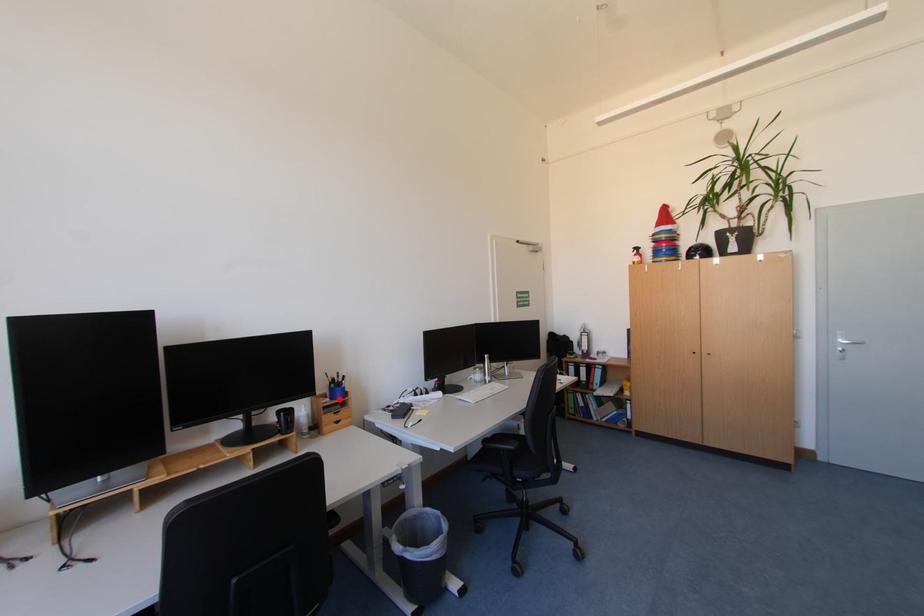
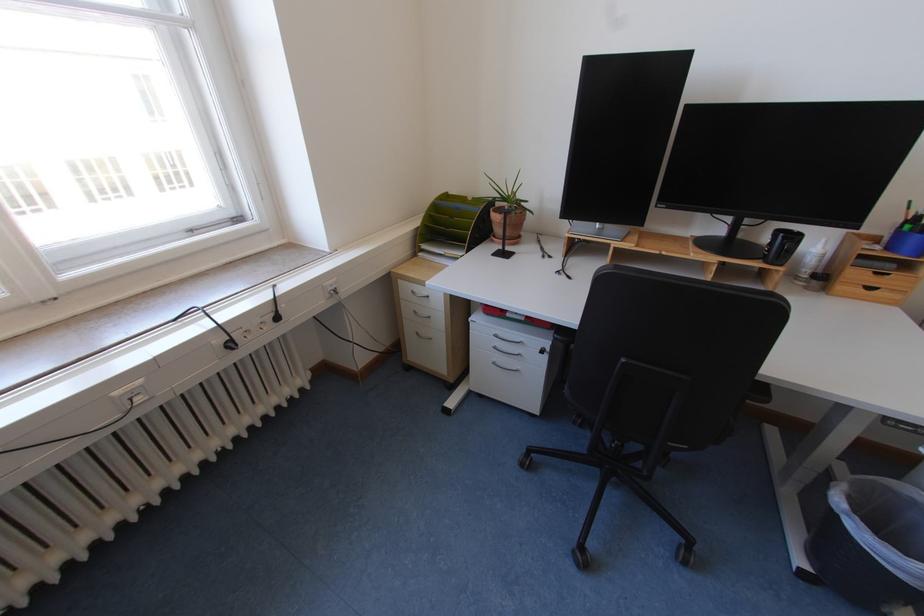
The point at the highlighted location is marked in the first image. Where is the corresponding point in the second image?

(896, 249)